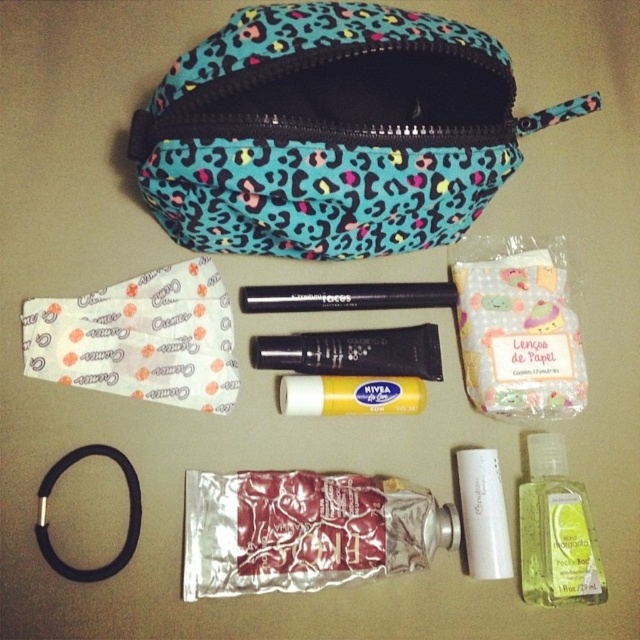
Is metallic silver snack at center shorter than white paper toothpaste at upper left?

Yes.

Can you confirm if metallic silver snack at center is positioned above white paper toothpaste at upper left?

Actually, metallic silver snack at center is below white paper toothpaste at upper left.

Between point (369, 547) and point (36, 323), which one is positioned in front?

Point (36, 323)

You are a GUI agent. You are given a task and a screenshot of the screen. Output one action in this format:
    pyautogui.click(x=<x>, y=<y>)
    Task: Click on the metallic silver snack at center
    
    Given the screenshot: What is the action you would take?
    click(305, 531)

Does white paper toothpaste at upper left have a larger size compared to white matte tube at center?

Yes, white paper toothpaste at upper left is bigger than white matte tube at center.

Is white paper toothpaste at upper left shorter than white matte tube at center?

In fact, white paper toothpaste at upper left may be taller than white matte tube at center.

This screenshot has width=640, height=640. What do you see at coordinates (140, 339) in the screenshot? I see `white paper toothpaste at upper left` at bounding box center [140, 339].

Find the location of a particular element. The image size is (640, 640). white paper toothpaste at upper left is located at coordinates (140, 339).

Which is in front, point (307, 337) or point (381, 413)?

Point (307, 337) is in front.

Is point (326, 355) more distant than point (321, 410)?

Yes.

Find the location of a particular element. The width and height of the screenshot is (640, 640). black matte tube at center is located at coordinates (353, 353).